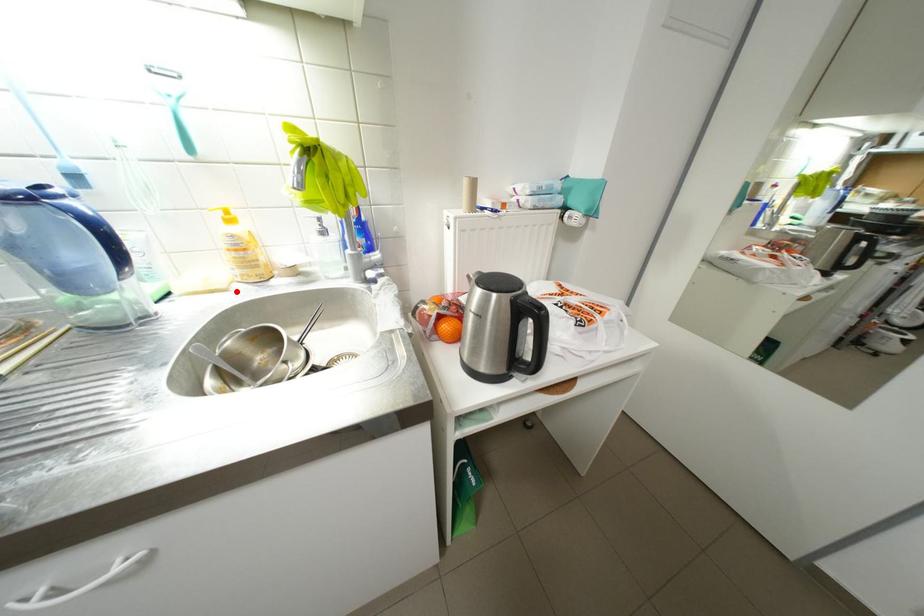
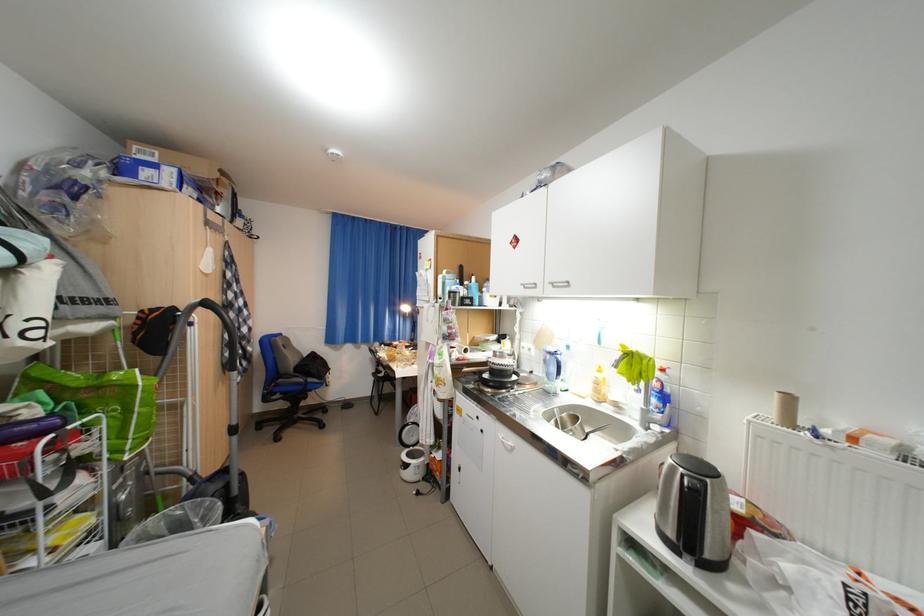
Question: A red point is marked in image1. In image2, is the corresponding 3D point closer to the camera or farther? Reply with the corresponding letter.

Choices:
 (A) The corresponding 3D point is closer.
 (B) The corresponding 3D point is farther.

Answer: (B)